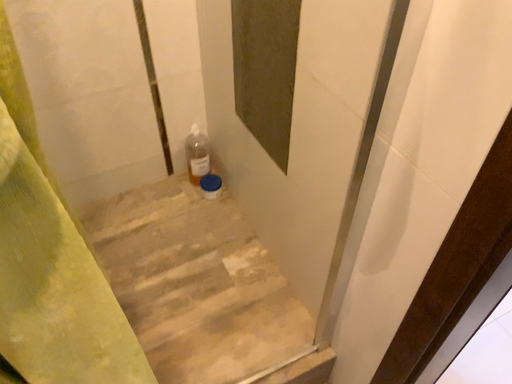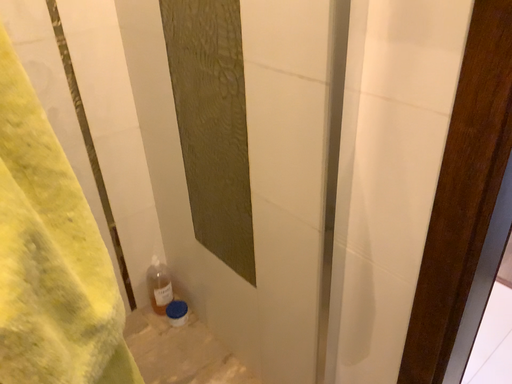
Question: How did the camera likely rotate when shooting the video?

Choices:
 (A) rotated upward
 (B) rotated downward

Answer: (A)